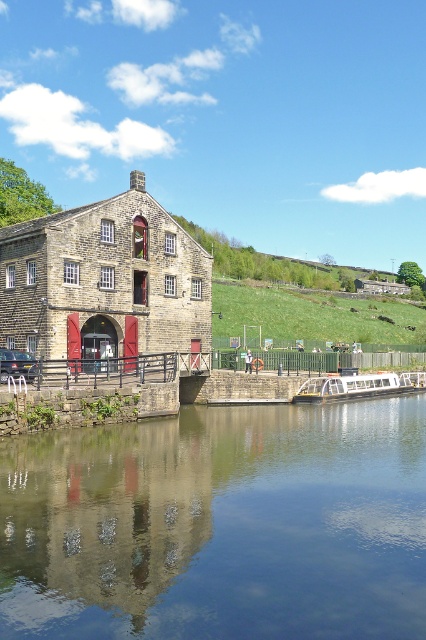
You are standing on the stone bridge and want to cross to the opposite bank. There is a white glossy boat at lower center and transparent glass water at center in your path. Which object should you avoid stepping on to reach the bank safely?

You should avoid stepping on the transparent glass water at center, as it is water and not solid ground. The white glossy boat at lower center is a solid structure you can step onto to cross safely.

You are a tourist standing on the stone bridge and want to take a photo of the white glossy boat at lower center and the transparent glass water at center. Which object will appear wider in the photo?

The transparent glass water at center will appear wider in the photo because its width surpasses that of the white glossy boat at lower center.

You are standing at the entrance of the large stone building with red doors. You see two points marked in the scene. Which point is closer to you, point (261,481) or point (425,388)?

Point (261,481) is in front of point (425,388), so it is closer to you.